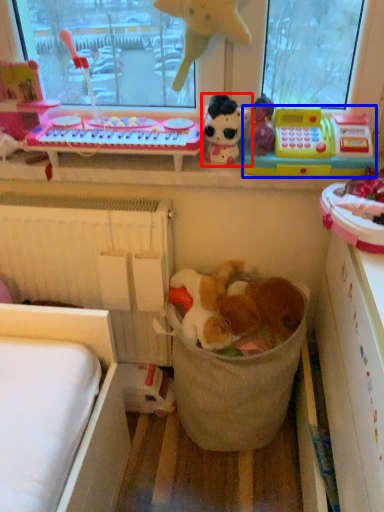
Question: Which of the following is the farthest to the observer, toy (highlighted by a red box) or toy (highlighted by a blue box)?

Choices:
 (A) toy
 (B) toy

Answer: (A)